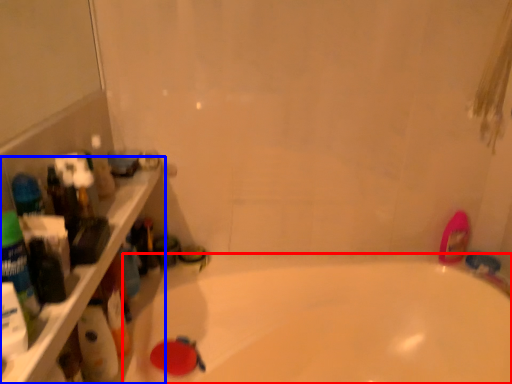
Question: Among these objects, which one is farthest to the camera, bathtub (highlighted by a red box) or ledge (highlighted by a blue box)?

Choices:
 (A) bathtub
 (B) ledge

Answer: (A)